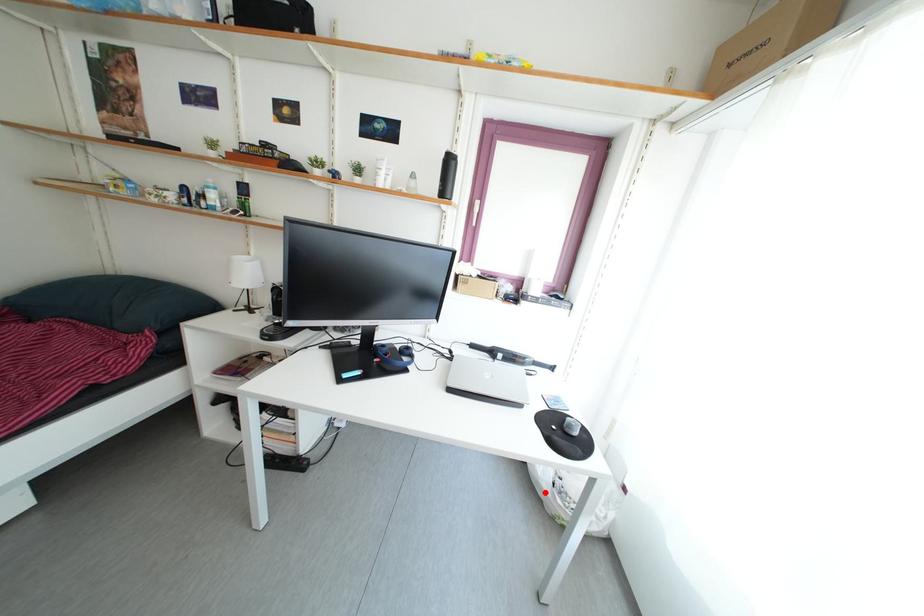
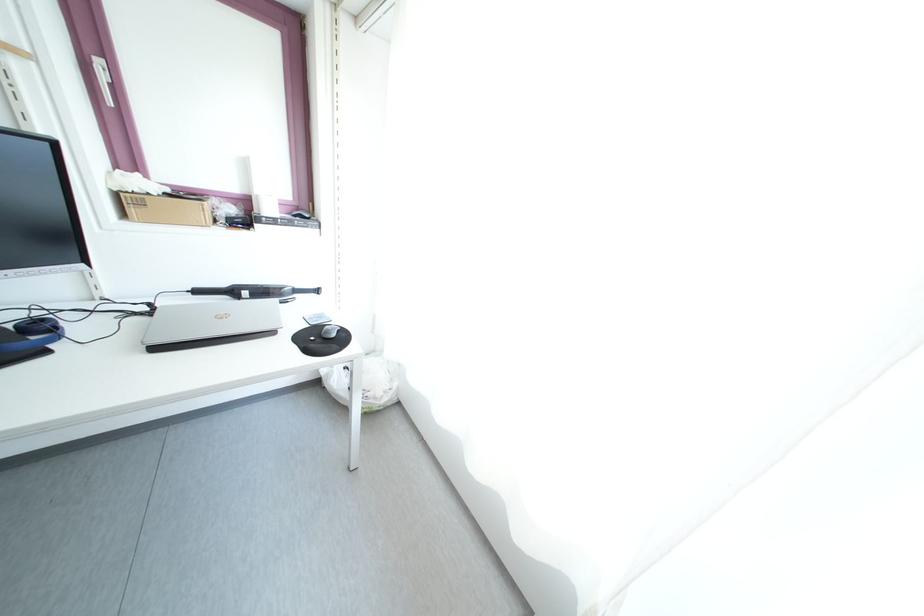
Question: I am providing you with two images of the same scene from different viewpoints. Image1 has a red point marked. In image2, the corresponding 3D location appears at what relative position? Reply with the corresponding letter.

Choices:
 (A) Closer
 (B) Farther

Answer: (B)